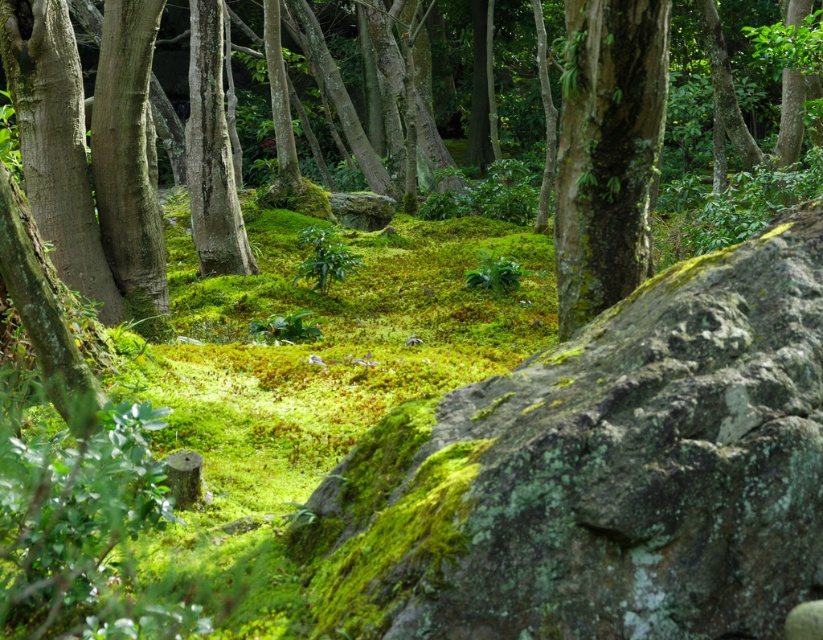
You are a hiker who wants to place a small marker between the green mossy bark at center and the green mossy bark at left. Which side should you place the marker closer to, considering the narrower mossy bark?

The green mossy bark at center has a lesser width compared to green mossy bark at left, so you should place the marker closer to the green mossy bark at center since it is narrower.

You are a botanist studying moss growth in the forest. You notice two areas of green mossy bark at center and green mossy bark at left. Which area has a bigger size?

The green mossy bark at center has a larger size compared to the green mossy bark at left.